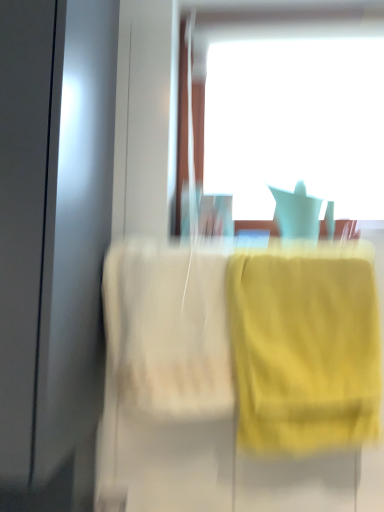
Find the location of a particular element. The image size is (384, 512). transparent glass window at upper center is located at coordinates (290, 108).

Describe the element at coordinates (290, 108) in the screenshot. I see `transparent glass window at upper center` at that location.

In the scene shown: In order to face yellow fabric towel at right, should I rotate leftwards or rightwards?

You should look right and rotate roughly 14.672 degrees.

Image resolution: width=384 pixels, height=512 pixels. What do you see at coordinates (305, 347) in the screenshot? I see `yellow fabric towel at right` at bounding box center [305, 347].

The width and height of the screenshot is (384, 512). I want to click on yellow fabric towel at right, so click(305, 347).

You are a GUI agent. You are given a task and a screenshot of the screen. Output one action in this format:
    pyautogui.click(x=<x>, y=<y>)
    Task: Click on the transparent glass window at upper center
    Image resolution: width=384 pixels, height=512 pixels.
    Given the screenshot: What is the action you would take?
    pyautogui.click(x=290, y=108)

Considering the positions of objects transparent glass window at upper center and yellow fabric towel at right in the image provided, who is more to the left, transparent glass window at upper center or yellow fabric towel at right?

yellow fabric towel at right.

Considering the relative positions of transparent glass window at upper center and yellow fabric towel at right in the image provided, is transparent glass window at upper center behind yellow fabric towel at right?

Yes, it is.

Considering the positions of points (315, 77) and (304, 380), is point (315, 77) closer to camera compared to point (304, 380)?

No, it is not.

From the image's perspective, is transparent glass window at upper center above or below yellow fabric towel at right?

transparent glass window at upper center is situated higher than yellow fabric towel at right in the image.

From a real-world perspective, is transparent glass window at upper center physically above yellow fabric towel at right?

Yes.

Does transparent glass window at upper center have a lesser width compared to yellow fabric towel at right?

Yes, transparent glass window at upper center is thinner than yellow fabric towel at right.

Considering the relative sizes of transparent glass window at upper center and yellow fabric towel at right in the image provided, is transparent glass window at upper center taller than yellow fabric towel at right?

Yes, transparent glass window at upper center is taller than yellow fabric towel at right.

Between transparent glass window at upper center and yellow fabric towel at right, which one has smaller size?

With smaller size is yellow fabric towel at right.

Would you say transparent glass window at upper center is outside yellow fabric towel at right?

Yes, transparent glass window at upper center is not within yellow fabric towel at right.

Is transparent glass window at upper center touching yellow fabric towel at right?

transparent glass window at upper center and yellow fabric towel at right are not in contact.

Is transparent glass window at upper center positioned with its back to yellow fabric towel at right?

transparent glass window at upper center does not have its back to yellow fabric towel at right.

Looking at this image, how many degrees apart are the facing directions of transparent glass window at upper center and yellow fabric towel at right?

2.42 degrees.

This screenshot has height=512, width=384. In order to click on window above the yellow fabric towel at right (from the image's perspective) in this screenshot , I will do `click(290, 108)`.

In the image, is yellow fabric towel at right on the left side or the right side of transparent glass window at upper center?

Based on their positions, yellow fabric towel at right is located to the left of transparent glass window at upper center.

Which object is closer to the camera taking this photo, yellow fabric towel at right or transparent glass window at upper center?

yellow fabric towel at right.

Is point (275, 445) closer or farther from the camera than point (346, 36)?

Point (275, 445) is positioned closer to the camera compared to point (346, 36).

From the image's perspective, is yellow fabric towel at right under transparent glass window at upper center?

Yes, from the image's perspective, yellow fabric towel at right is below transparent glass window at upper center.

From a real-world perspective, is yellow fabric towel at right physically above transparent glass window at upper center?

No.

Between yellow fabric towel at right and transparent glass window at upper center, which one has larger width?

yellow fabric towel at right is wider.

Does yellow fabric towel at right have a lesser height compared to transparent glass window at upper center?

Yes, yellow fabric towel at right is shorter than transparent glass window at upper center.

Can you confirm if yellow fabric towel at right is smaller than transparent glass window at upper center?

Indeed, yellow fabric towel at right has a smaller size compared to transparent glass window at upper center.

Is transparent glass window at upper center located within yellow fabric towel at right?

Definitely not — transparent glass window at upper center is not inside yellow fabric towel at right.

In the scene shown: Is yellow fabric towel at right touching transparent glass window at upper center?

No, yellow fabric towel at right is not touching transparent glass window at upper center.

Is yellow fabric towel at right aimed at transparent glass window at upper center?

No, yellow fabric towel at right is not facing towards transparent glass window at upper center.

How distant is yellow fabric towel at right from transparent glass window at upper center?

yellow fabric towel at right is 37.86 inches from transparent glass window at upper center.

Image resolution: width=384 pixels, height=512 pixels. In order to click on towel/napkin that is in front of the transparent glass window at upper center in this screenshot , I will do `click(305, 347)`.

Find the location of `towel/napkin that is in front of the transparent glass window at upper center`. towel/napkin that is in front of the transparent glass window at upper center is located at coordinates (305, 347).

I want to click on window that appears on the right of yellow fabric towel at right, so click(290, 108).